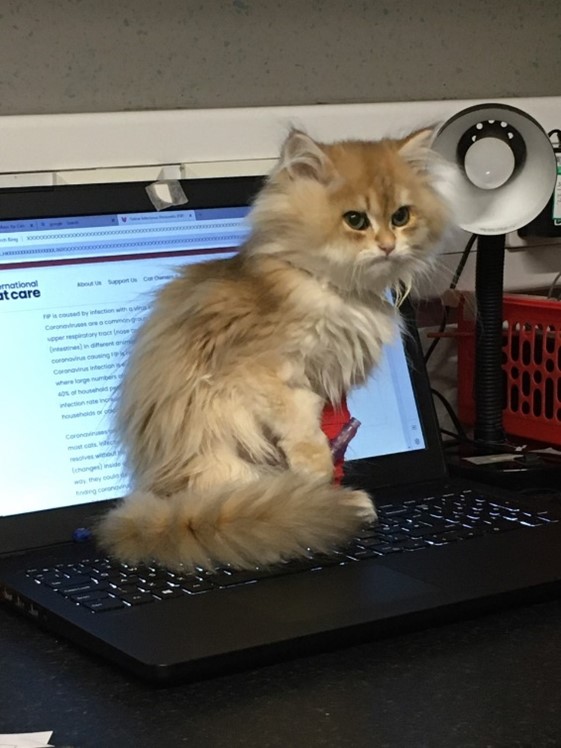
At what (x,y) coordinates should I click in order to perform the action: click on red radiator panel. Please return your answer as a coordinate pair (x, y). Looking at the image, I should click on (542, 370).